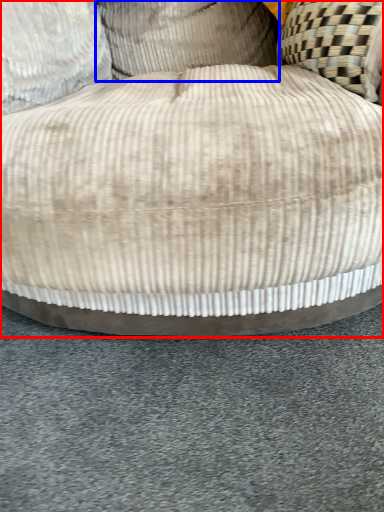
Question: Which object is further to the camera taking this photo, furniture (highlighted by a red box) or pillow (highlighted by a blue box)?

Choices:
 (A) furniture
 (B) pillow

Answer: (B)